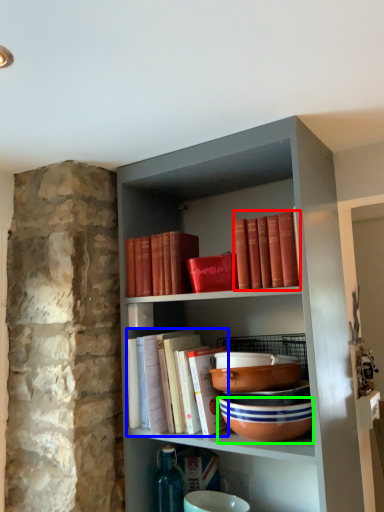
Question: Which is nearer to the book (highlighted by a red box)? book (highlighted by a blue box) or bowl (highlighted by a green box).

Choices:
 (A) book
 (B) bowl

Answer: (B)